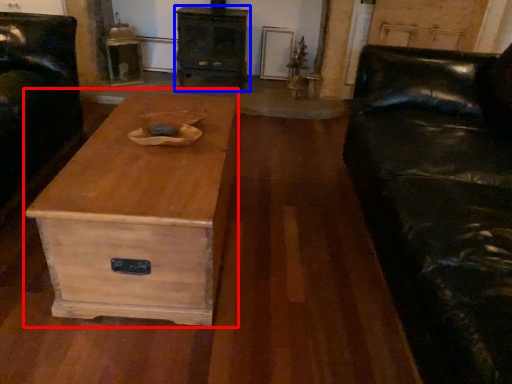
Question: Which object appears closest to the camera in this image, coffee table (highlighted by a red box) or chest of drawers (highlighted by a blue box)?

Choices:
 (A) coffee table
 (B) chest of drawers

Answer: (A)